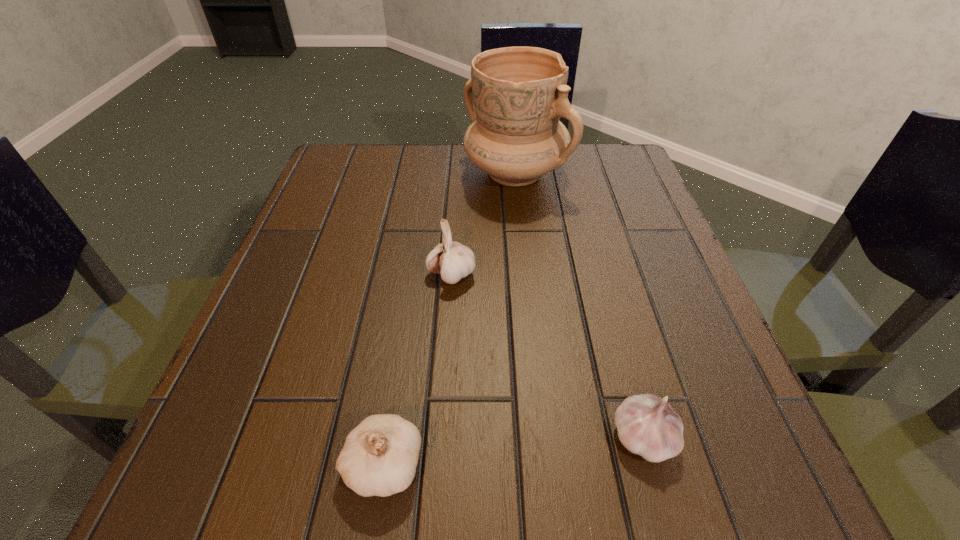
Locate an element on the screen. This screenshot has width=960, height=540. vacant position in the image that satisfies the following two spatial constraints: 1. on the back side of the pottery; 2. on the left side of the second farthest object is located at coordinates (458, 173).